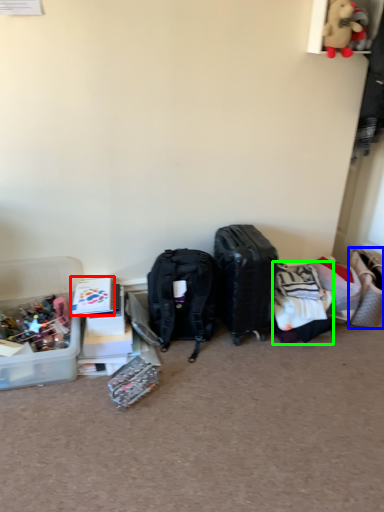
Question: Which object is the closest to the storage box (highlighted by a red box)? Choose among these: handbag (highlighted by a blue box) or clothing (highlighted by a green box).

Choices:
 (A) handbag
 (B) clothing

Answer: (B)